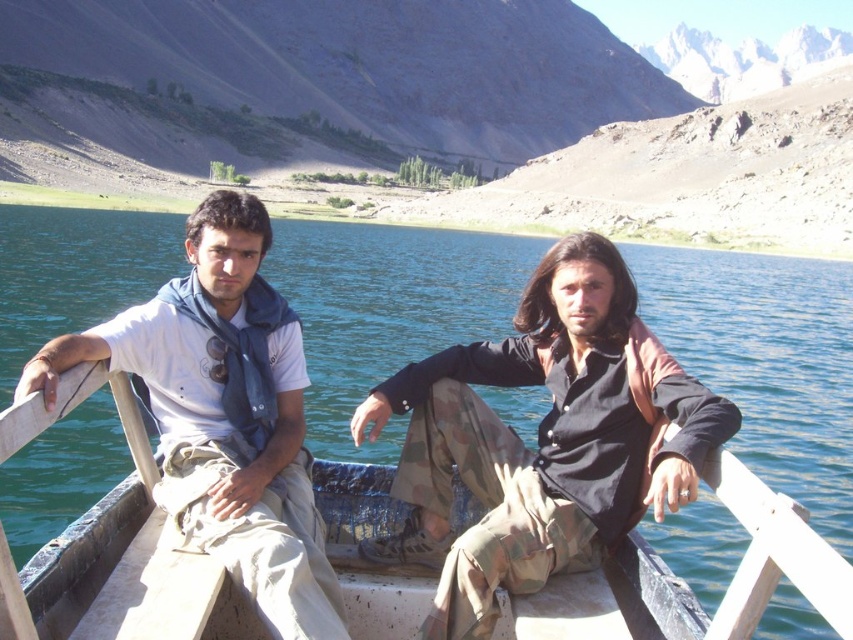
Based on the scene, which object takes up more space in the image between the clear blue water at center and the camouflage pants at center?

The clear blue water at center takes up more space in the image than the camouflage pants at center.

You are a photographer standing on the dock and want to take a picture of the clear blue water at center and the white cotton shirt at left. Which object should you focus on first if you want to ensure both are in focus?

The white cotton shirt at left is closer to you than the clear blue water at center, so you should focus on the white cotton shirt at left first to ensure both are in focus.

You are standing on the dock, and you want to throw a lifebuoy to the person wearing the camouflage pants at center and the person wearing the white cotton shirt at left. Which one is closer to you?

Result: The white cotton shirt at left is closer to you since the camouflage pants at center is 4.13 meters away from the white cotton shirt at left, meaning the white cotton shirt at left is nearer to your position on the dock.